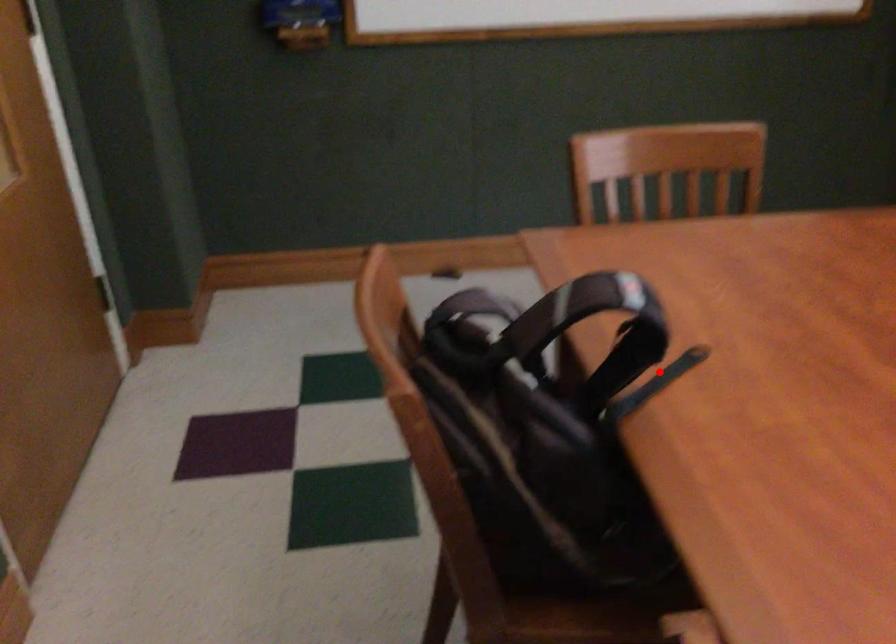
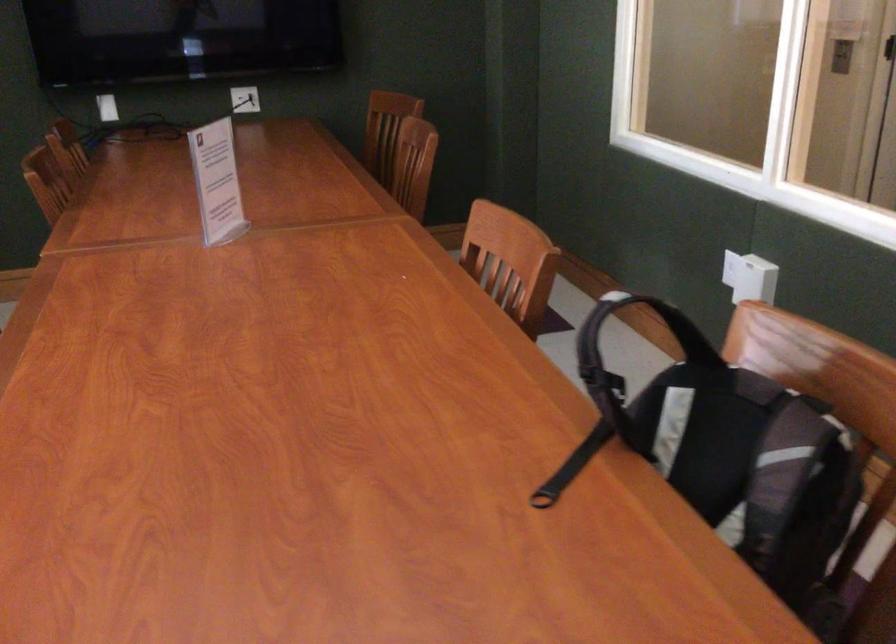
Find the pixel in the second image that matches the highlighted location in the first image.

(572, 466)